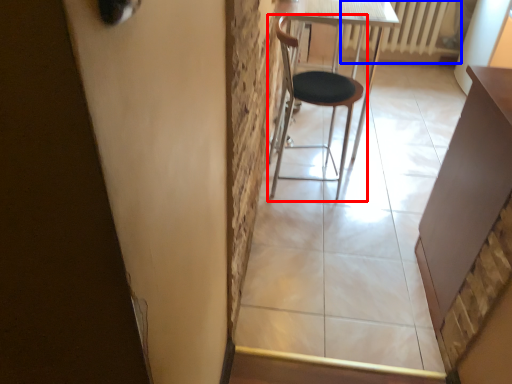
Question: Which object appears farthest to the camera in this image, chair (highlighted by a red box) or radiator (highlighted by a blue box)?

Choices:
 (A) chair
 (B) radiator

Answer: (B)